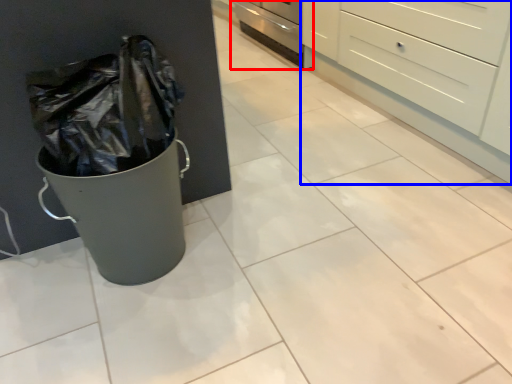
Question: Which object is closer to the camera taking this photo, oven (highlighted by a red box) or chest of drawers (highlighted by a blue box)?

Choices:
 (A) oven
 (B) chest of drawers

Answer: (B)